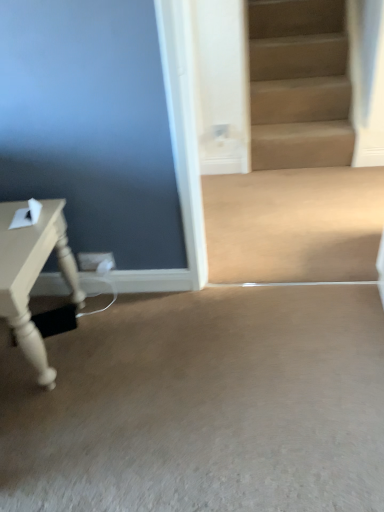
Question: Can you confirm if matte white table at left is positioned to the right of beige smooth concrete at center, arranged as the 2th concrete when viewed from the front?

Choices:
 (A) no
 (B) yes

Answer: (A)

Question: From the image's perspective, is matte white table at left located above beige smooth concrete at center, arranged as the 2th concrete when viewed from the front?

Choices:
 (A) no
 (B) yes

Answer: (A)

Question: Is matte white table at left far from beige smooth concrete at center, the second concrete in the bottom-to-top sequence?

Choices:
 (A) yes
 (B) no

Answer: (A)

Question: From a real-world perspective, is matte white table at left positioned under beige smooth concrete at center, arranged as the 2th concrete when viewed from the front, based on gravity?

Choices:
 (A) yes
 (B) no

Answer: (B)

Question: Considering the relative sizes of matte white table at left and beige smooth concrete at center, acting as the 1th concrete starting from the back, in the image provided, is matte white table at left thinner than beige smooth concrete at center, acting as the 1th concrete starting from the back,?

Choices:
 (A) no
 (B) yes

Answer: (B)

Question: Is matte white table at left to the left of beige smooth concrete at center, arranged as the 2th concrete when viewed from the front, from the viewer's perspective?

Choices:
 (A) no
 (B) yes

Answer: (B)

Question: Is beige carpet at lower center, the 2th concrete when ordered from top to bottom, looking in the opposite direction of beige smooth concrete at center, acting as the 1th concrete starting from the back?

Choices:
 (A) yes
 (B) no

Answer: (B)

Question: Is the position of beige carpet at lower center, which is counted as the first concrete, starting from the bottom, more distant than that of beige smooth concrete at center, arranged as the 2th concrete when viewed from the front?

Choices:
 (A) yes
 (B) no

Answer: (B)

Question: From the image's perspective, is beige carpet at lower center, marked as the 2th concrete in a back-to-front arrangement, under beige smooth concrete at center, acting as the 1th concrete starting from the back?

Choices:
 (A) no
 (B) yes

Answer: (B)

Question: From a real-world perspective, is beige carpet at lower center, which is counted as the first concrete, starting from the bottom, located beneath beige smooth concrete at center, which appears as the 1th concrete when viewed from the top?

Choices:
 (A) no
 (B) yes

Answer: (B)

Question: Does beige carpet at lower center, which ranks as the 1th concrete in front-to-back order, have a greater height compared to beige smooth concrete at center, which appears as the 1th concrete when viewed from the top?

Choices:
 (A) no
 (B) yes

Answer: (B)

Question: Is beige carpet at lower center, marked as the 2th concrete in a back-to-front arrangement, not close to beige smooth concrete at center, acting as the 1th concrete starting from the back?

Choices:
 (A) yes
 (B) no

Answer: (B)

Question: Is beige carpet at lower center, the 2th concrete when ordered from top to bottom, oriented away from matte white table at left?

Choices:
 (A) yes
 (B) no

Answer: (B)